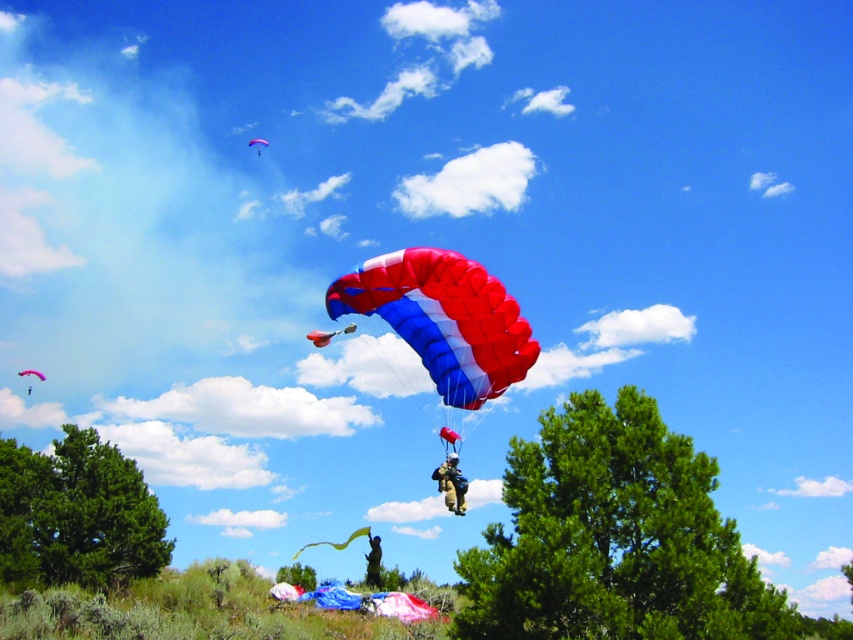
Question: Which object appears closest to the camera in this image?

Choices:
 (A) blue/white nylon parachute at center
 (B) green leafy tree at lower left
 (C) blue and white fabric parachute at center

Answer: (B)

Question: Which point appears farthest from the camera in this image?

Choices:
 (A) click(639, 554)
 (B) click(445, 456)
 (C) click(286, 573)

Answer: (C)

Question: Considering the real-world distances, which object is farthest from the matte khaki jumpsuit at center?

Choices:
 (A) green leafy tree at lower left
 (B) red and blue fabric parachute at center

Answer: (A)

Question: Is the position of green leafy tree at lower left less distant than that of red nylon parachute at upper center?

Choices:
 (A) yes
 (B) no

Answer: (A)

Question: Is red fabric parachute at center positioned in front of red nylon parachute at upper center?

Choices:
 (A) yes
 (B) no

Answer: (A)

Question: Does green leafy tree at lower right appear over camouflage fabric parachute at center?

Choices:
 (A) no
 (B) yes

Answer: (B)